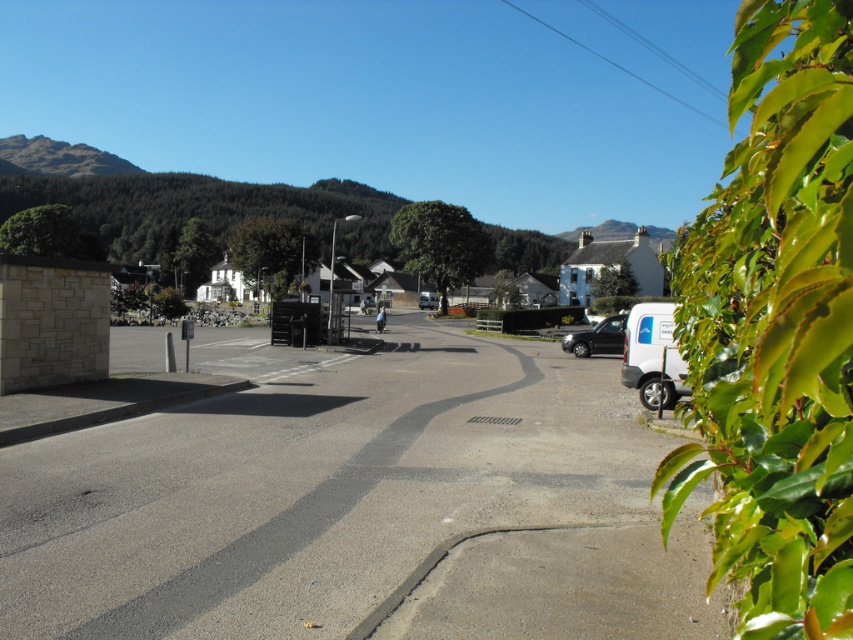
You are a photographer planning to take a picture of the shiny black car at center from the green leafy hedge at right. Can you see the entire car without any obstruction from the hedge?

The green leafy hedge at right is above the shiny black car at center, so you can see the entire car without obstruction from the hedge.

You are a delivery driver who needs to park your truck, which is 2 meters tall, in this parking area. The shiny black car at center and the white matte van at center are already parked there. Based on their heights, can your truck fit between them without hitting the roof?

The shiny black car at center is not as tall as white matte van at center. Since the white matte van at center is taller than the shiny black car at center, and assuming the truck is 2 meters tall, you need to compare the height of the white matte van at center. However, the exact height of the van isn not provided. Therefore, it is uncertain if the truck can fit without more information about the van height.